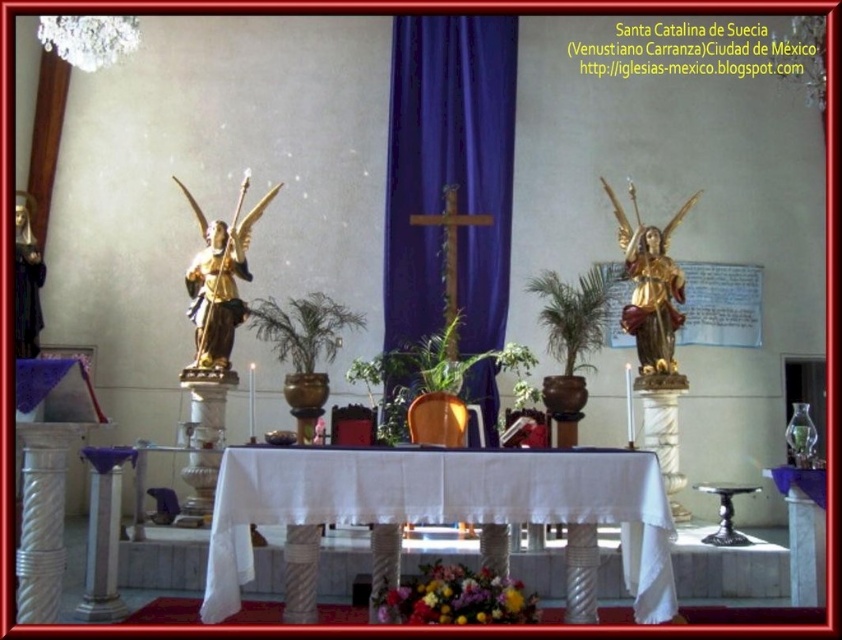
You are an altar server preparing for a ceremony. You need to place a large crucifix between the gold polished statue at center and the gold polished statue at left. Which statue should you position the crucifix closer to to ensure it is balanced?

The gold polished statue at center has a larger size compared to gold polished statue at left. To balance the crucifix placement, position it closer to the gold polished statue at left since it is smaller, counterbalancing the larger statue at center.